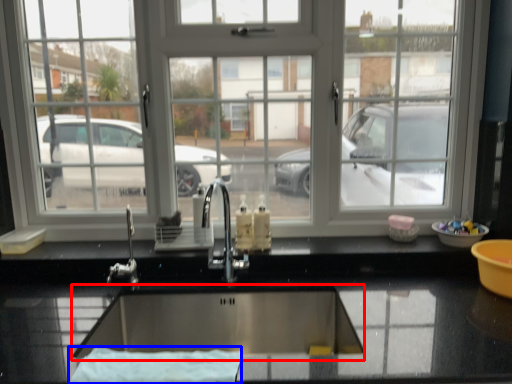
Question: Which object is further to the camera taking this photo, wide (highlighted by a red box) or bath towel (highlighted by a blue box)?

Choices:
 (A) wide
 (B) bath towel

Answer: (A)